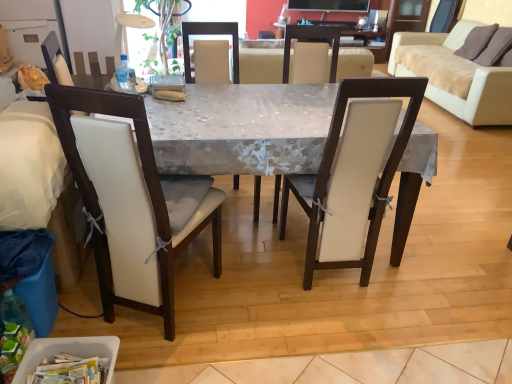
At what (x,y) coordinates should I click in order to perform the action: click on vacant area that lies between white leather chair at center, placed as the first chair when sorted from right to left, and matte white table at center. Please return your answer as a coordinate pair (x, y). The height and width of the screenshot is (384, 512). Looking at the image, I should click on (310, 294).